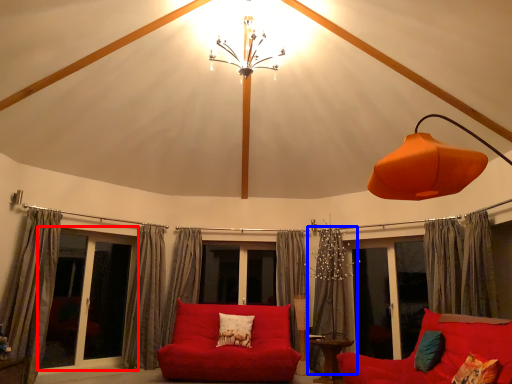
Question: Which point is closer to the camera, bay window (highlighted by a red box) or curtain (highlighted by a blue box)?

Choices:
 (A) bay window
 (B) curtain

Answer: (A)